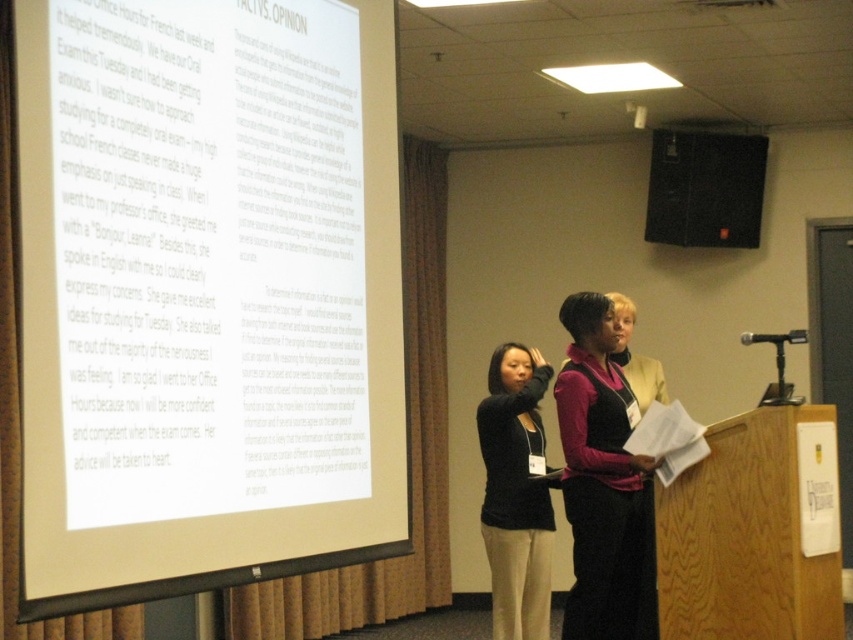
Can you confirm if white matte projector screen at upper left is thinner than matte black dress at center?

In fact, white matte projector screen at upper left might be wider than matte black dress at center.

Can you confirm if white matte projector screen at upper left is positioned above matte black dress at center?

Yes, white matte projector screen at upper left is above matte black dress at center.

Does point (338, 515) come behind point (618, 525)?

No, (338, 515) is closer to viewer.

Identify the location of white matte projector screen at upper left. (206, 294).

Which is above, white matte projector screen at upper left or black matte speaker at upper right?

black matte speaker at upper right is higher up.

What do you see at coordinates (206, 294) in the screenshot?
I see `white matte projector screen at upper left` at bounding box center [206, 294].

In order to click on white matte projector screen at upper left in this screenshot , I will do `click(206, 294)`.

Locate an element on the screen. matte black dress at center is located at coordinates click(x=602, y=483).

Can you confirm if matte black dress at center is wider than black sweater at center?

Yes, matte black dress at center is wider than black sweater at center.

The height and width of the screenshot is (640, 853). In order to click on matte black dress at center in this screenshot , I will do `click(602, 483)`.

Find the location of `matte black dress at center`. matte black dress at center is located at coordinates (602, 483).